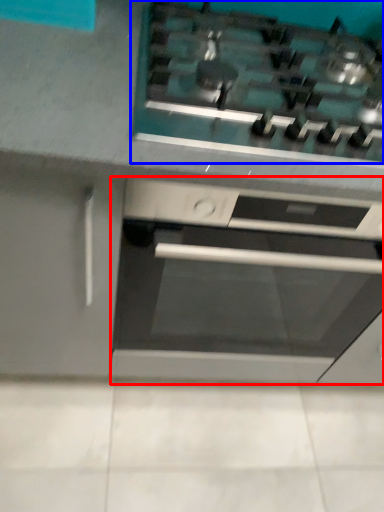
Question: Which object appears closest to the camera in this image, home appliance (highlighted by a red box) or gas stove (highlighted by a blue box)?

Choices:
 (A) home appliance
 (B) gas stove

Answer: (B)